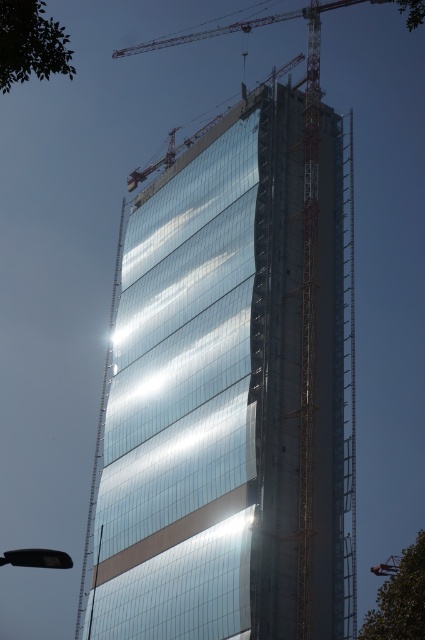
You are an architect observing the construction site. You need to determine the relative positions of the transparent glass building at center and the metallic yellow crane at upper center. Which object is positioned higher in the image?

The metallic yellow crane at upper center is positioned higher than the transparent glass building at center in the image.

You are an architect standing at the construction site of the transparent glass building at center. You need to place a new support beam at coordinates point 0.616, 0.485. Is there enough space to place it there?

The transparent glass building at center is already positioned at point (206, 394), so there is no space to place the new support beam there as it would overlap with the building.

You are a delivery truck driver who needs to back up your truck to the construction site to unload materials. The truck requires a minimum of 20 meters of clearance to safely maneuver. Given the distance between the transparent glass building at center and the metallic yellow crane at upper center, do you think you have enough space to safely back up your truck?

The transparent glass building at center is 20.44 meters from the metallic yellow crane at upper center, which is just over the required 20 meters of clearance needed. Therefore, there is sufficient space for the truck to safely maneuver and unload materials.